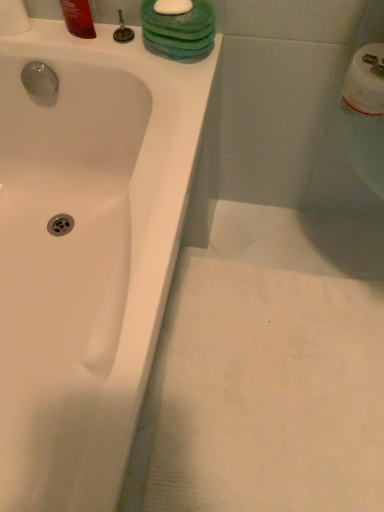
The width and height of the screenshot is (384, 512). I want to click on vacant area situated to the left side of matte silver faucet at upper center, so click(64, 38).